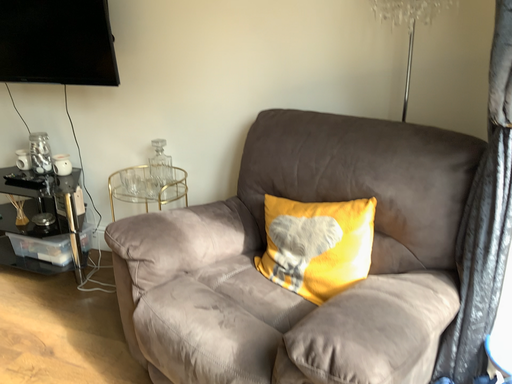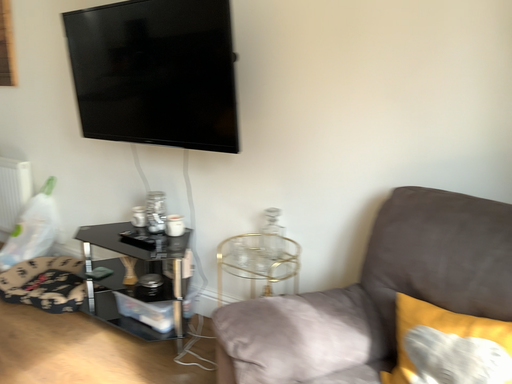
Question: How did the camera likely rotate when shooting the video?

Choices:
 (A) rotated upward
 (B) rotated downward

Answer: (A)